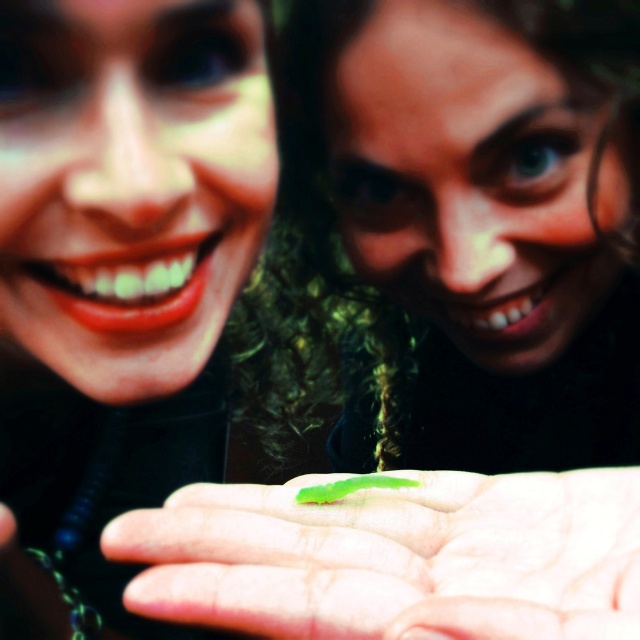
You are a photographer who wants to capture a closeup of the green rubber worm at center. The camera you are using has a minimum focusing distance of 12 inches. Can you take the photo without moving the worm?

The green rubber worm at center is 12.29 inches from viewer. Since the minimum focusing distance is 12 inches, the camera can focus on the worm as it is slightly beyond the minimum distance.

You are a photographer adjusting the focus on your camera. You need to focus on the point that is closer to the camera between the two points labeled point (272,492) and point (381,483). Which point should you choose?

You should focus on point (272,492) because it is closer to the camera than point (381,483) according to the description.

You are an entomologist examining two green caterpillars in the image. The green rubber worm at center and the green matte caterpillar at center. Which one has a greater width?

The green rubber worm at center has a greater width than the green matte caterpillar at center.